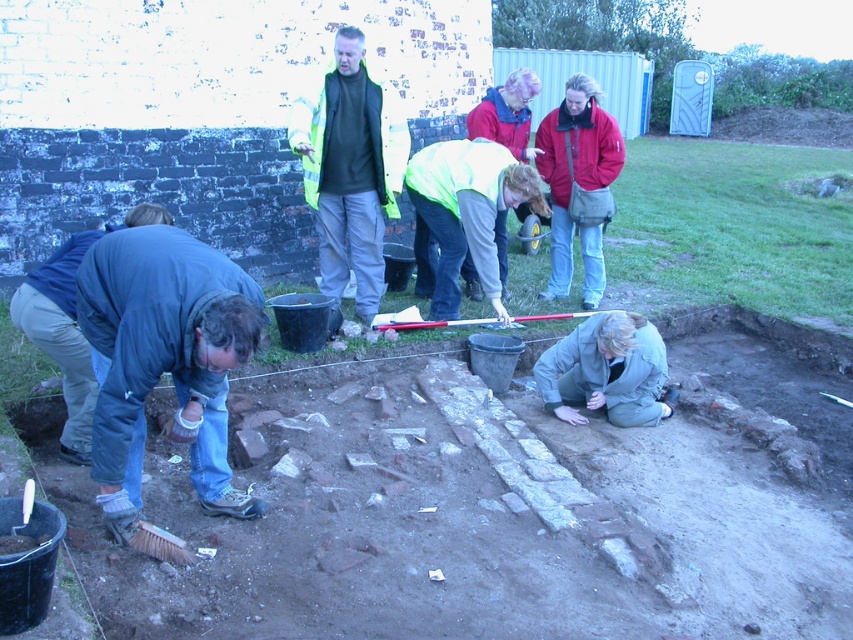
Question: Is high-visibility vest at center bigger than khaki fabric jacket at lower right?

Choices:
 (A) yes
 (B) no

Answer: (A)

Question: Among these objects, which one is nearest to the camera?

Choices:
 (A) high-visibility vest at center
 (B) light green reflective jacket at center
 (C) khaki fabric jacket at lower right
 (D) blue denim jeans at lower left

Answer: (D)

Question: Can you confirm if light green reflective jacket at center is positioned below red jacket at center?

Choices:
 (A) no
 (B) yes

Answer: (B)

Question: Which point is farther to the camera?

Choices:
 (A) (554, 156)
 (B) (355, 112)
 (C) (461, 230)

Answer: (A)

Question: Which object is farther from the camera taking this photo?

Choices:
 (A) matte yellow jacket at center
 (B) high-visibility vest at center
 (C) red jacket at center

Answer: (A)

Question: Can you confirm if light green reflective jacket at center is positioned to the left of matte yellow jacket at center?

Choices:
 (A) yes
 (B) no

Answer: (A)